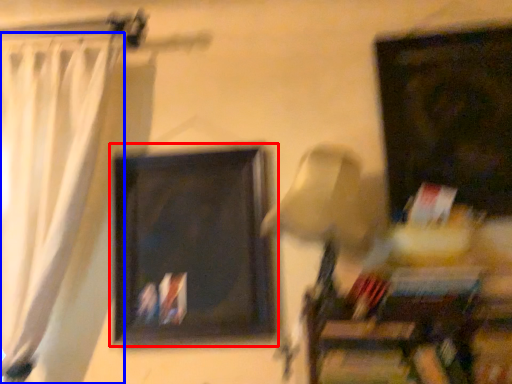
Question: Which of the following is the farthest to the observer, picture frame (highlighted by a red box) or curtain (highlighted by a blue box)?

Choices:
 (A) picture frame
 (B) curtain

Answer: (A)